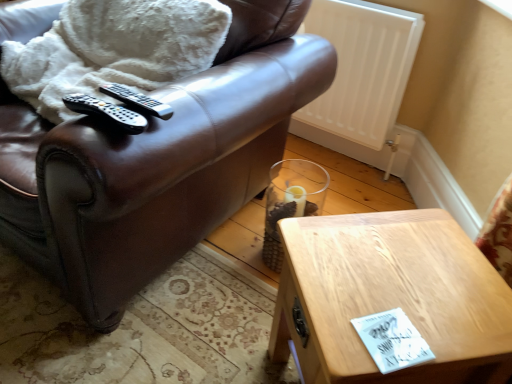
Question: In which direction should I rotate to look at black plastic remote at center, the first remote in the front-to-back sequence?

Choices:
 (A) right
 (B) left

Answer: (B)

Question: Can you confirm if clear glass vase at lower center is shorter than black plastic remote at upper left, which ranks as the first remote in back-to-front order?

Choices:
 (A) no
 (B) yes

Answer: (A)

Question: Can you confirm if clear glass vase at lower center is wider than black plastic remote at upper left, the second remote positioned from the front?

Choices:
 (A) yes
 (B) no

Answer: (A)

Question: Can you confirm if clear glass vase at lower center is positioned to the left of black plastic remote at upper left, the second remote positioned from the front?

Choices:
 (A) no
 (B) yes

Answer: (A)

Question: Is clear glass vase at lower center facing away from black plastic remote at upper left, the second remote positioned from the front?

Choices:
 (A) no
 (B) yes

Answer: (A)

Question: From the image's perspective, would you say clear glass vase at lower center is positioned over black plastic remote at upper left, the second remote positioned from the front?

Choices:
 (A) yes
 (B) no

Answer: (B)

Question: Is clear glass vase at lower center oriented towards black plastic remote at upper left, the second remote positioned from the front?

Choices:
 (A) yes
 (B) no

Answer: (B)

Question: Is brown leather chair at upper left wider than clear glass vase at lower center?

Choices:
 (A) yes
 (B) no

Answer: (A)

Question: From a real-world perspective, is brown leather chair at upper left located higher than clear glass vase at lower center?

Choices:
 (A) no
 (B) yes

Answer: (B)

Question: Are brown leather chair at upper left and clear glass vase at lower center far apart?

Choices:
 (A) yes
 (B) no

Answer: (B)

Question: From the image's perspective, is brown leather chair at upper left over clear glass vase at lower center?

Choices:
 (A) no
 (B) yes

Answer: (B)

Question: Considering the relative sizes of brown leather chair at upper left and clear glass vase at lower center in the image provided, is brown leather chair at upper left shorter than clear glass vase at lower center?

Choices:
 (A) no
 (B) yes

Answer: (A)

Question: Can you confirm if brown leather chair at upper left is bigger than clear glass vase at lower center?

Choices:
 (A) no
 (B) yes

Answer: (B)

Question: From a real-world perspective, is white fluffy blanket at upper left under clear glass vase at lower center?

Choices:
 (A) no
 (B) yes

Answer: (A)